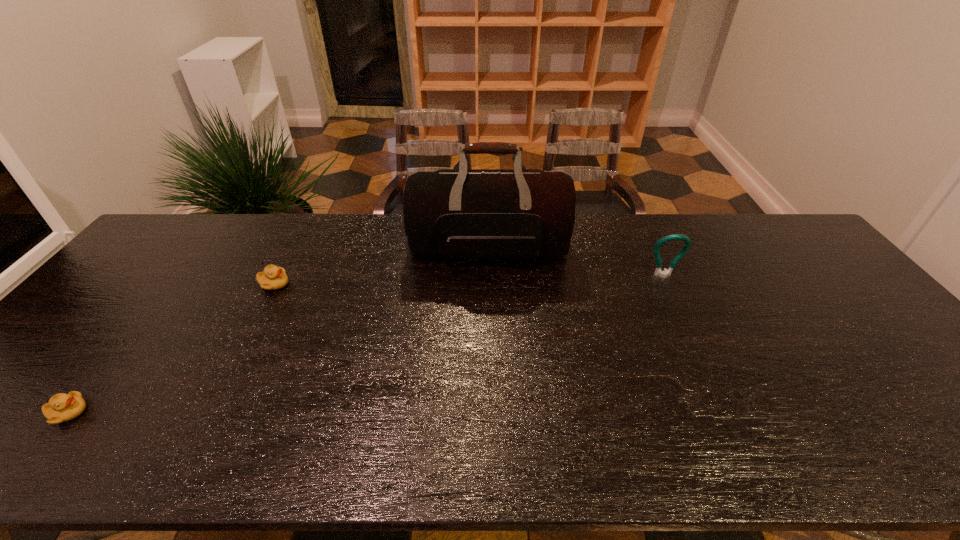
Where is `vacant area located 0.380m on the front-facing side of the farther duckling`? The image size is (960, 540). vacant area located 0.380m on the front-facing side of the farther duckling is located at coordinates (417, 284).

Locate an element on the screen. vacant point located 0.180m at the beak of the nearest object is located at coordinates (166, 413).

Find the location of a particular element. object that is at the far edge is located at coordinates (487, 214).

In order to click on object that is at the near edge in this screenshot , I will do `click(62, 407)`.

Where is `object at the left edge`? Image resolution: width=960 pixels, height=540 pixels. object at the left edge is located at coordinates (62, 407).

You are a GUI agent. You are given a task and a screenshot of the screen. Output one action in this format:
    pyautogui.click(x=<x>, y=<y>)
    Task: Click on the object at the near left corner
    
    Given the screenshot: What is the action you would take?
    coord(62,407)

At what (x,y) coordinates should I click in order to perform the action: click on vacant space at the far edge. Please return your answer as a coordinate pair (x, y). Looking at the image, I should click on (646, 213).

In the image, there is a desktop. Identify the location of vacant space at the near edge. (782, 464).

In order to click on free space at the left edge of the desktop in this screenshot , I will do `click(56, 377)`.

Where is `vacant region at the right edge of the desktop`? This screenshot has width=960, height=540. vacant region at the right edge of the desktop is located at coordinates (801, 286).